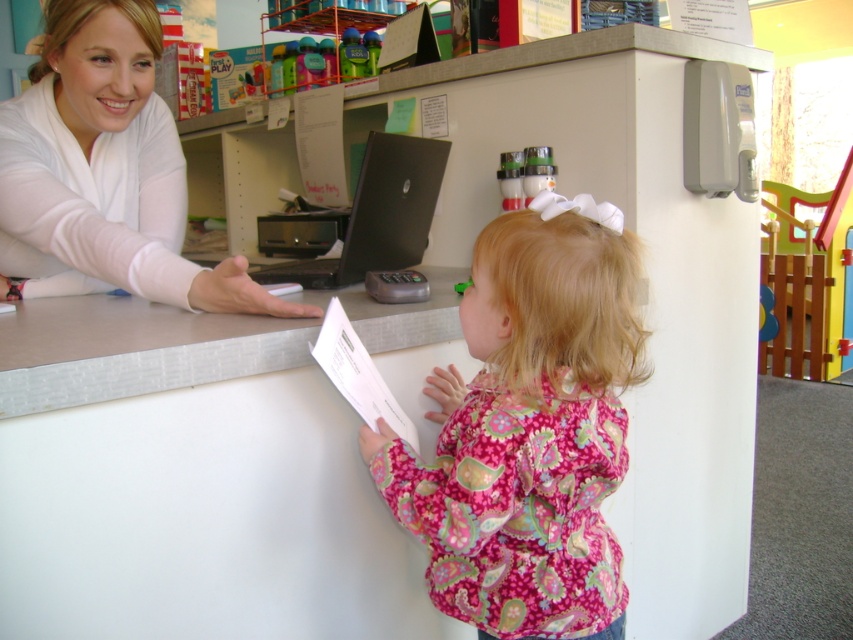
You are standing in the play area and want to place a small toy on the closest surface between the white smooth desk at center and the black matte laptop at center. Which one should you choose?

The white smooth desk at center is closer to the viewer than the black matte laptop at center, so you should place the toy on the white smooth desk at center.

You are an interior designer assessing the layout of this play area. You notice the matte white shirt at upper left and the black matte laptop at center. Which object is taller?

The matte white shirt at upper left is taller than the black matte laptop at center.